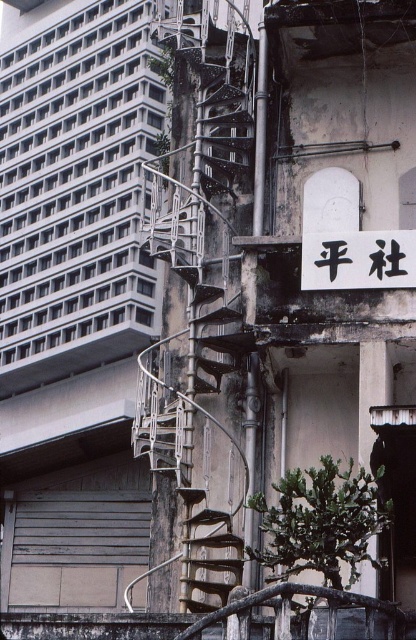
Who is positioned more to the left, rusty metal fire escape at center or black matte sign at upper center?

Positioned to the left is rusty metal fire escape at center.

Find the location of `rusty metal fire escape at center`. rusty metal fire escape at center is located at coordinates (202, 292).

Locate an element on the screen. The image size is (416, 640). rusty metal fire escape at center is located at coordinates (202, 292).